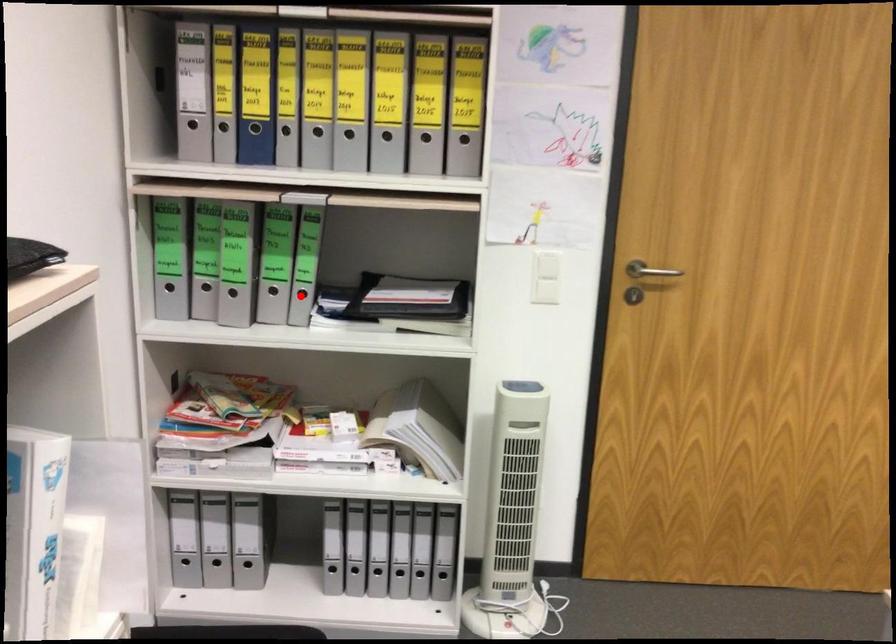
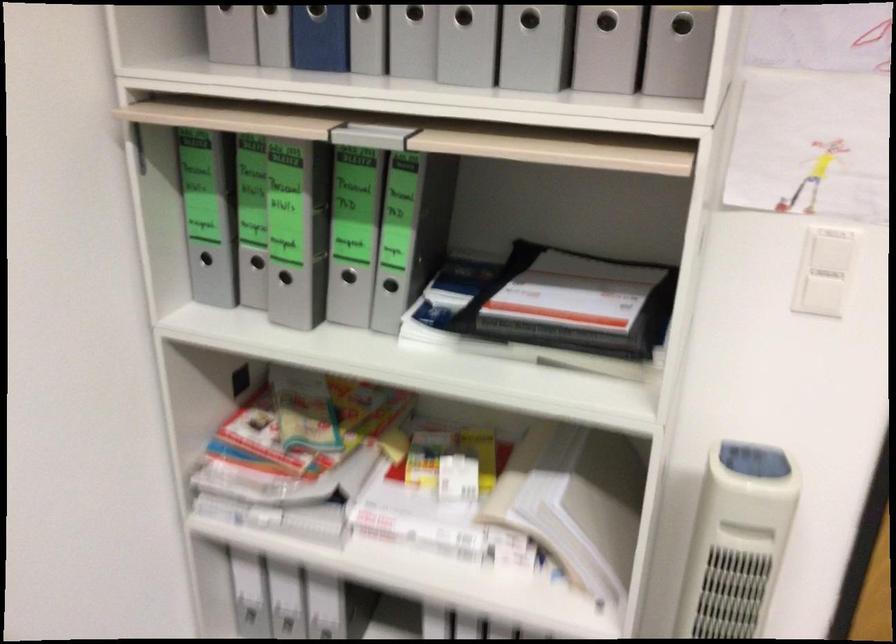
Question: I am providing you with two images of the same scene from different viewpoints. A red point is marked on the first image. At the location where the point appears in image 1, is it still visible in image 2?

Choices:
 (A) Yes
 (B) No

Answer: (A)